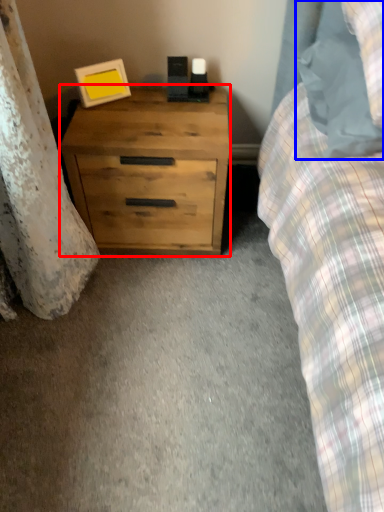
Question: Which object appears closest to the camera in this image, chest of drawers (highlighted by a red box) or pillow (highlighted by a blue box)?

Choices:
 (A) chest of drawers
 (B) pillow

Answer: (B)